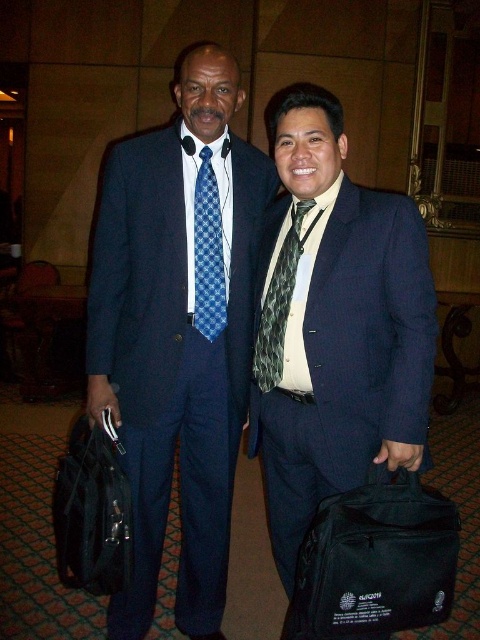
Who is positioned more to the right, black fabric bag at lower right or blue checkered tie at center?

black fabric bag at lower right

Can you confirm if black fabric bag at lower right is positioned above blue checkered tie at center?

Actually, black fabric bag at lower right is below blue checkered tie at center.

Describe the element at coordinates (375, 561) in the screenshot. This screenshot has height=640, width=480. I see `black fabric bag at lower right` at that location.

Where is `black fabric bag at lower right`? Image resolution: width=480 pixels, height=640 pixels. black fabric bag at lower right is located at coordinates (375, 561).

Does point (325, 442) lie behind point (432, 582)?

That is True.

Is matte black suit at center shorter than black fabric bag at lower right?

In fact, matte black suit at center may be taller than black fabric bag at lower right.

Between point (290, 321) and point (298, 593), which one is positioned in front?

Point (298, 593) is in front.

Where is `matte black suit at center`? The height and width of the screenshot is (640, 480). matte black suit at center is located at coordinates (335, 324).

Is black fabric bag at lower left wider than green textured tie at center?

Yes.

Does point (112, 586) lie behind point (276, 320)?

No, (112, 586) is in front of (276, 320).

Locate an element on the screen. The height and width of the screenshot is (640, 480). black fabric bag at lower left is located at coordinates (93, 509).

Where is `black fabric bag at lower left`? The height and width of the screenshot is (640, 480). black fabric bag at lower left is located at coordinates [93, 509].